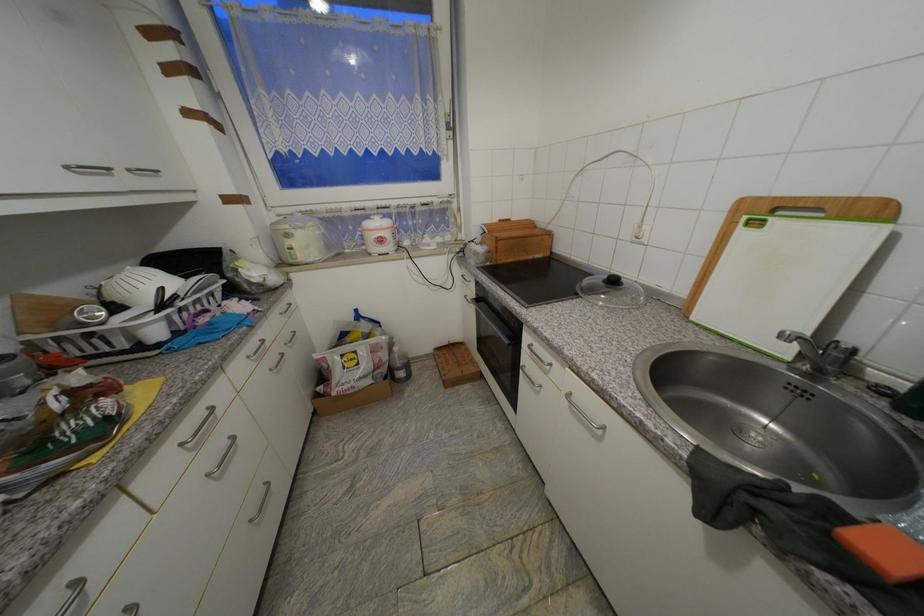
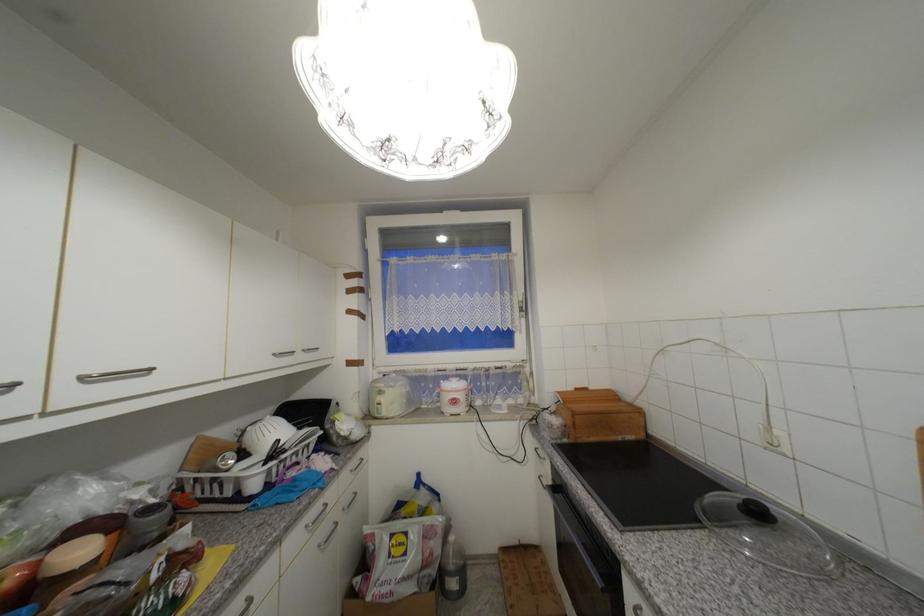
Locate, in the second image, the point that corresponds to point (480, 299) in the first image.

(555, 485)